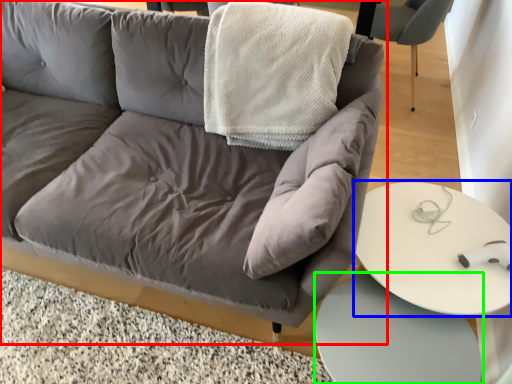
Question: Considering the real-world distances, which object is farthest from studio couch (highlighted by a red box)? table (highlighted by a blue box) or table (highlighted by a green box)?

Choices:
 (A) table
 (B) table

Answer: (B)